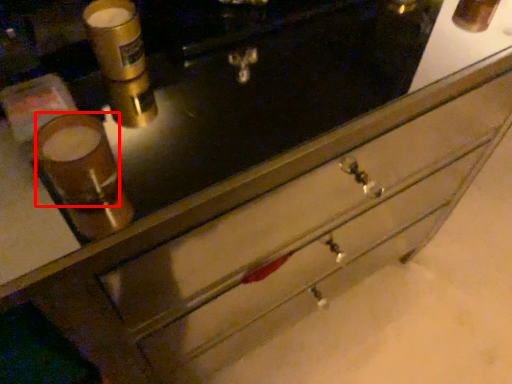
Question: Where is beverage (annotated by the red box) located in relation to beverage in the image?

Choices:
 (A) left
 (B) right

Answer: (A)